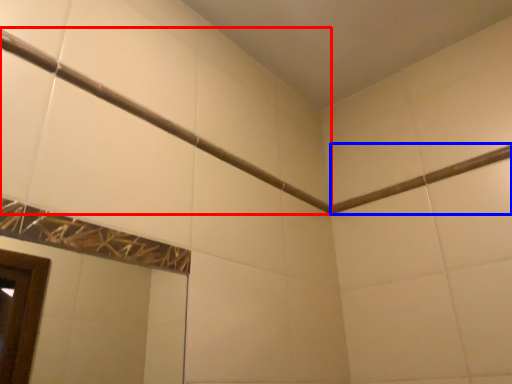
Question: Which object is further to the camera taking this photo, shower (highlighted by a red box) or beam (highlighted by a blue box)?

Choices:
 (A) shower
 (B) beam

Answer: (B)